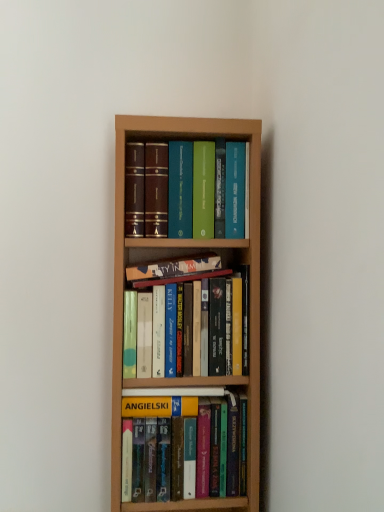
Find the location of a particular element. The width and height of the screenshot is (384, 512). vacant point above hardcover books at center, acting as the 1th book starting from the top (from a real-world perspective) is located at coordinates (190, 140).